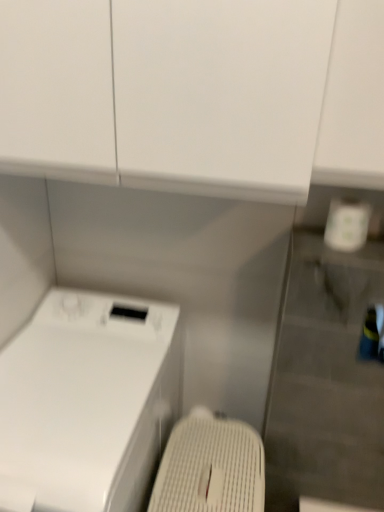
Question: Should I look upward or downward to see white textured washing machine at lower center?

Choices:
 (A) down
 (B) up

Answer: (A)

Question: Is white glossy washing machine at lower left completely or partially inside white textured washing machine at lower center?

Choices:
 (A) yes
 (B) no

Answer: (B)

Question: From a real-world perspective, is white textured washing machine at lower center positioned under white glossy washing machine at lower left based on gravity?

Choices:
 (A) yes
 (B) no

Answer: (A)

Question: Does white textured washing machine at lower center have a lesser width compared to white glossy washing machine at lower left?

Choices:
 (A) no
 (B) yes

Answer: (B)

Question: Considering the relative positions of white textured washing machine at lower center and white glossy washing machine at lower left in the image provided, is white textured washing machine at lower center to the right of white glossy washing machine at lower left from the viewer's perspective?

Choices:
 (A) no
 (B) yes

Answer: (B)

Question: Does white textured washing machine at lower center have a smaller size compared to white glossy washing machine at lower left?

Choices:
 (A) no
 (B) yes

Answer: (B)

Question: Is white textured washing machine at lower center next to white glossy washing machine at lower left and touching it?

Choices:
 (A) yes
 (B) no

Answer: (B)

Question: Is white glossy washing machine at lower left with white textured washing machine at lower center?

Choices:
 (A) no
 (B) yes

Answer: (A)

Question: From a real-world perspective, does white glossy washing machine at lower left stand above white textured washing machine at lower center?

Choices:
 (A) no
 (B) yes

Answer: (B)

Question: Does white glossy washing machine at lower left turn towards white textured washing machine at lower center?

Choices:
 (A) no
 (B) yes

Answer: (A)

Question: Is white glossy washing machine at lower left positioned behind white textured washing machine at lower center?

Choices:
 (A) no
 (B) yes

Answer: (A)

Question: From a real-world perspective, is white glossy washing machine at lower left below white textured washing machine at lower center?

Choices:
 (A) no
 (B) yes

Answer: (A)

Question: Considering the relative positions of white glossy washing machine at lower left and white textured washing machine at lower center in the image provided, is white glossy washing machine at lower left to the left of white textured washing machine at lower center from the viewer's perspective?

Choices:
 (A) yes
 (B) no

Answer: (A)

Question: In terms of size, does white glossy washing machine at lower left appear bigger or smaller than white textured washing machine at lower center?

Choices:
 (A) big
 (B) small

Answer: (A)